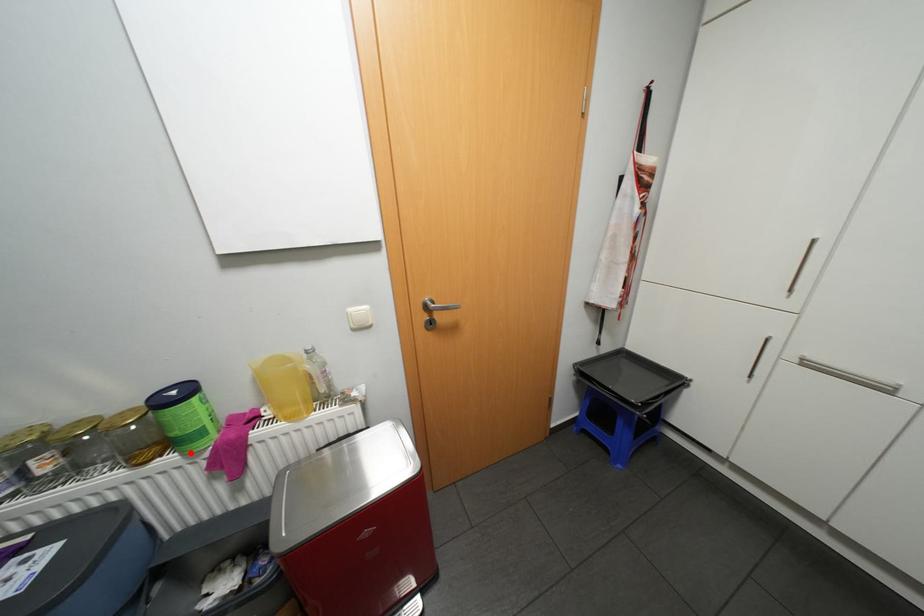
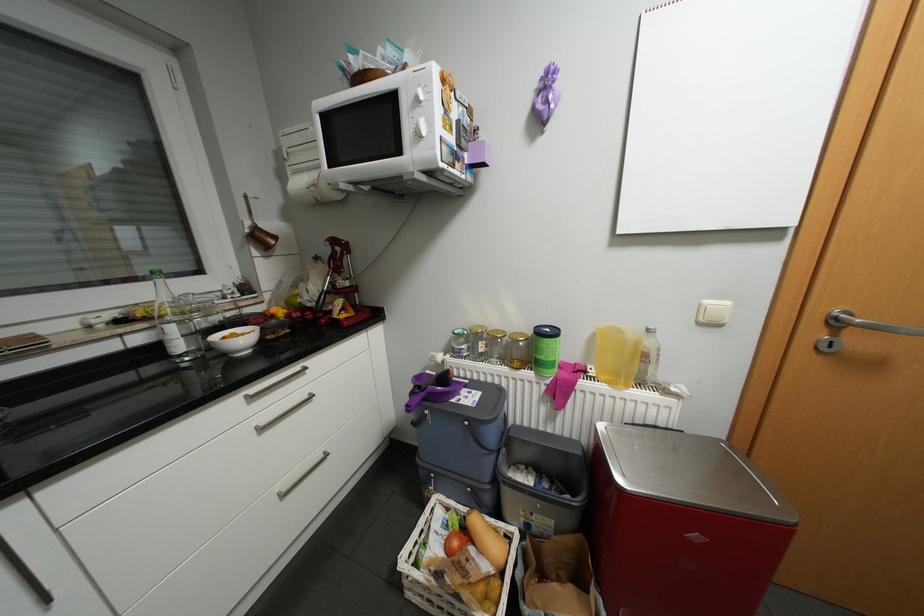
In the second image, find the point that corresponds to the highlighted location in the first image.

(544, 373)